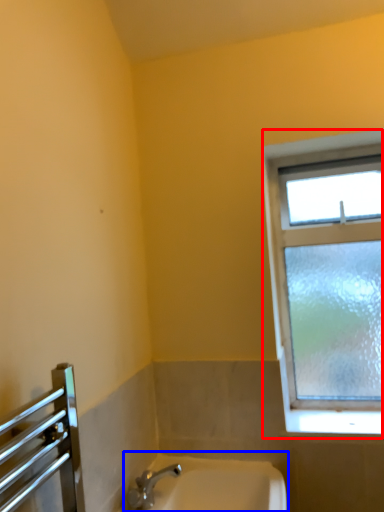
Question: Among these objects, which one is nearest to the camera, window (highlighted by a red box) or sink (highlighted by a blue box)?

Choices:
 (A) window
 (B) sink

Answer: (B)